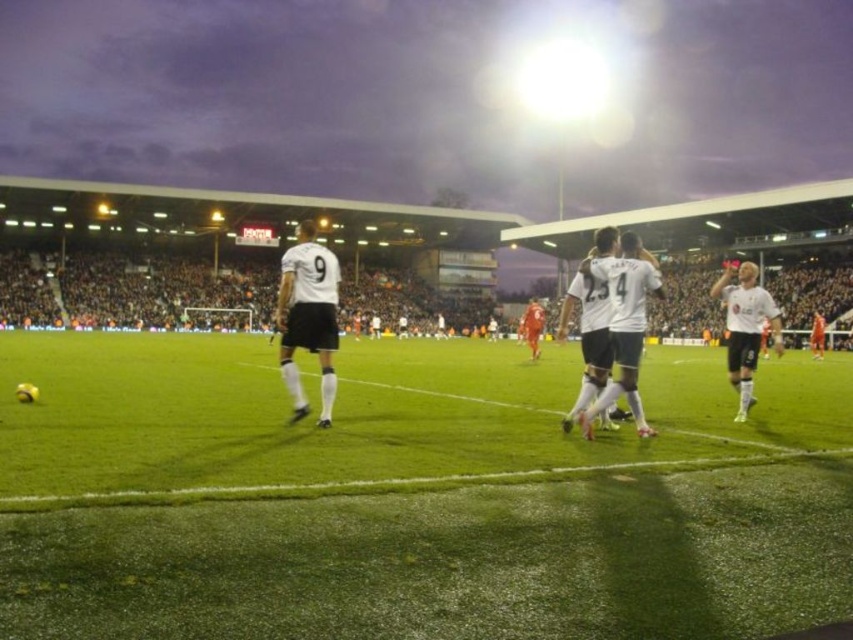
You are a drone operator trying to capture the celebration moment between the players. The two points you need to focus on are point (294, 266) and point (630, 323). Which point is closer to the camera?

Point (294, 266) is closer to the camera than point (630, 323).

You are a photographer positioned at the edge of the soccer field. You want to take a photo of the white jersey at center and the white matte jersey at right. Which jersey will appear larger in your photo?

The white jersey at center will appear larger in the photo because it is closer to the viewer than the white matte jersey at right.